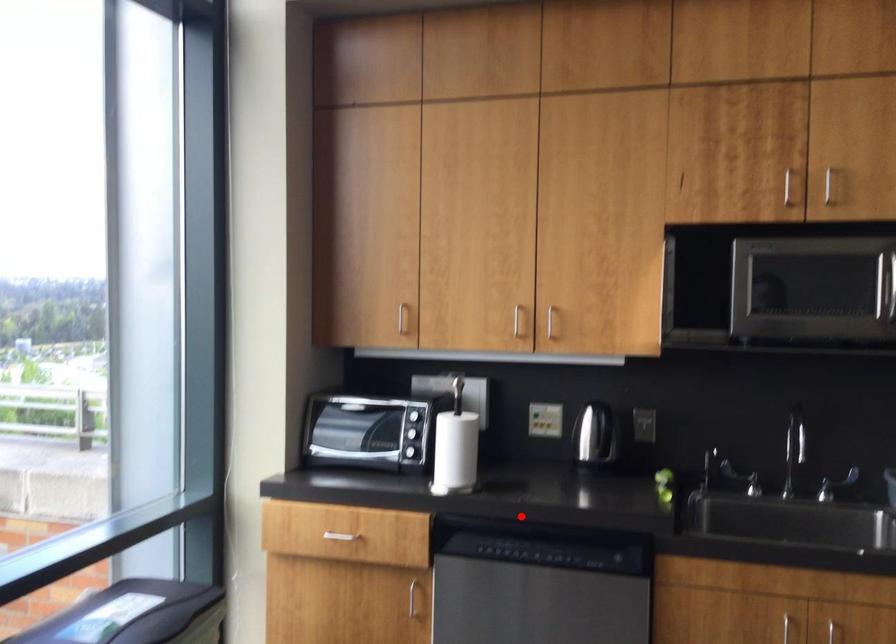
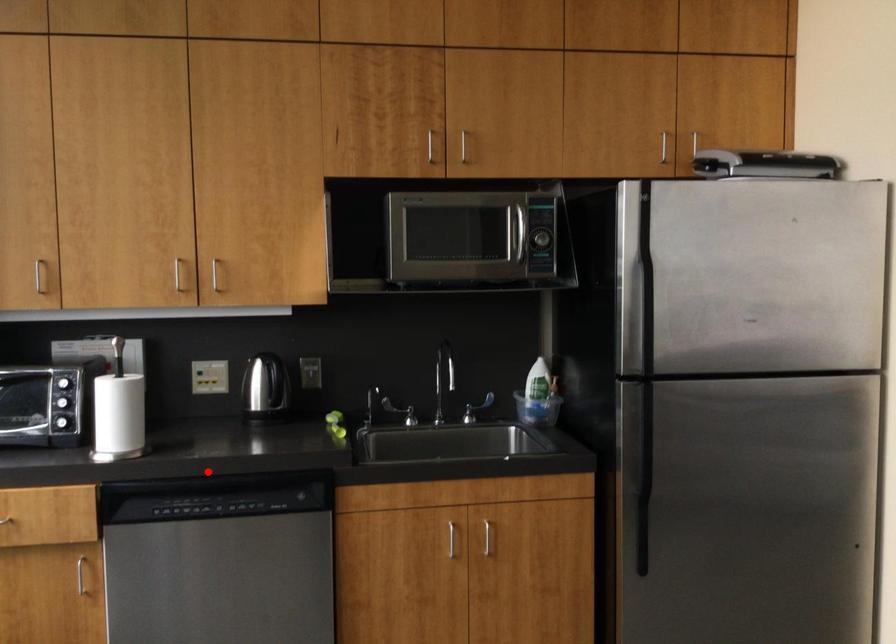
I am providing you with two images of the same scene from different viewpoints. A red point is marked on the first image and another point is marked on the second image. Is the red point in image1 aligned with the point shown in image2?

Yes